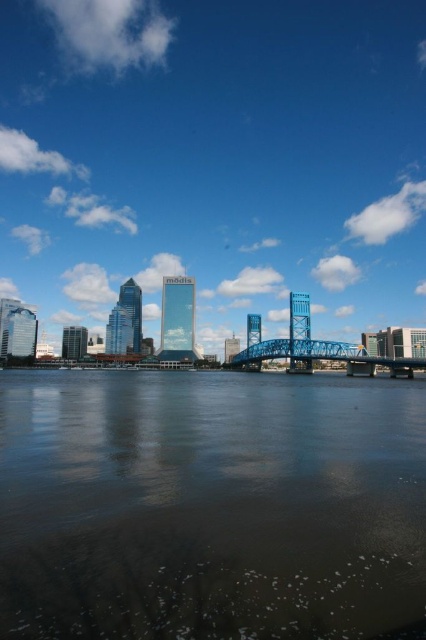
Question: Can you confirm if transparent glass bridge at center is wider than brown reflective water at center?

Choices:
 (A) yes
 (B) no

Answer: (A)

Question: Where is brown reflective water at center located in relation to blue metallic bridge at center in the image?

Choices:
 (A) left
 (B) right

Answer: (A)

Question: Can you confirm if brown reflective water at center is positioned above blue metallic bridge at center?

Choices:
 (A) yes
 (B) no

Answer: (B)

Question: Among these objects, which one is farthest from the camera?

Choices:
 (A) transparent glass bridge at center
 (B) brown reflective water at center

Answer: (A)

Question: Which of the following is the closest to the observer?

Choices:
 (A) (71, 81)
 (B) (368, 388)

Answer: (B)

Question: Which object appears farthest from the camera in this image?

Choices:
 (A) transparent glass bridge at center
 (B) brown reflective water at center
 (C) blue metallic bridge at center

Answer: (A)